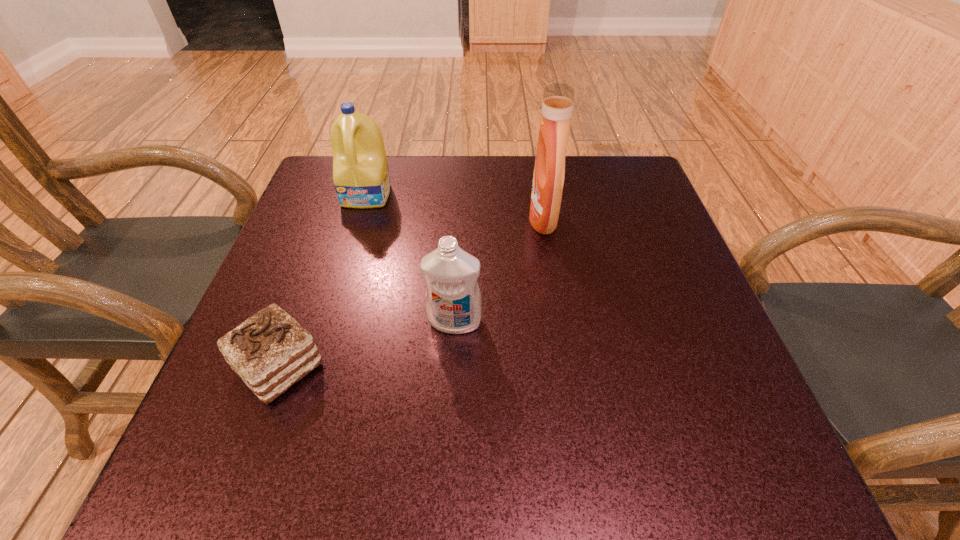
Where is `the tallest detergent`? the tallest detergent is located at coordinates (549, 171).

Identify the location of the tallest object. The image size is (960, 540). (549, 171).

Where is `the leftmost detergent`? the leftmost detergent is located at coordinates (361, 177).

Locate an element on the screen. This screenshot has width=960, height=540. the nearest detergent is located at coordinates (453, 303).

Where is `the third object from left to right`? Image resolution: width=960 pixels, height=540 pixels. the third object from left to right is located at coordinates (453, 303).

At what (x,y) coordinates should I click in order to perform the action: click on the shortest object. Please return your answer as a coordinate pair (x, y). This screenshot has width=960, height=540. Looking at the image, I should click on (270, 351).

The image size is (960, 540). What are the coordinates of `vacant point located on the front-facing side of the tallest detergent` in the screenshot? It's located at (391, 219).

Locate an element on the screen. vacant space located on the front-facing side of the tallest detergent is located at coordinates (482, 219).

Locate an element on the screen. Image resolution: width=960 pixels, height=540 pixels. free space located on the front-facing side of the tallest detergent is located at coordinates (408, 219).

This screenshot has width=960, height=540. I want to click on vacant space located 0.310m on the label of the leftmost detergent, so click(332, 311).